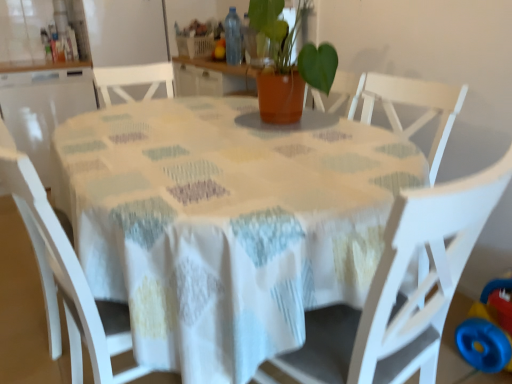
Question: Does terracotta pot at center appear on the right side of white fabric table at center?

Choices:
 (A) no
 (B) yes

Answer: (B)

Question: Is terracotta pot at center to the left of white fabric table at center from the viewer's perspective?

Choices:
 (A) no
 (B) yes

Answer: (A)

Question: From the image's perspective, is terracotta pot at center located beneath white fabric table at center?

Choices:
 (A) no
 (B) yes

Answer: (A)

Question: Is terracotta pot at center oriented towards white fabric table at center?

Choices:
 (A) yes
 (B) no

Answer: (B)

Question: From the image's perspective, is terracotta pot at center over white fabric table at center?

Choices:
 (A) yes
 (B) no

Answer: (A)

Question: Is terracotta pot at center far from white fabric table at center?

Choices:
 (A) yes
 (B) no

Answer: (B)

Question: Would you say blue plastic toy at lower right is part of white wood chair at center, which is the 2th chair from left to right,'s contents?

Choices:
 (A) yes
 (B) no

Answer: (B)

Question: Is white wood chair at center, the first chair when ordered from right to left, further to the viewer compared to blue plastic toy at lower right?

Choices:
 (A) yes
 (B) no

Answer: (B)

Question: From a real-world perspective, is white wood chair at center, which is the 2th chair from left to right, located beneath blue plastic toy at lower right?

Choices:
 (A) yes
 (B) no

Answer: (B)

Question: Would you consider white wood chair at center, which is the 2th chair from left to right, to be distant from blue plastic toy at lower right?

Choices:
 (A) yes
 (B) no

Answer: (B)

Question: Does white wood chair at center, which is the 2th chair from left to right, have a lesser width compared to blue plastic toy at lower right?

Choices:
 (A) no
 (B) yes

Answer: (A)

Question: From a real-world perspective, is white wood chair at center, which is the 2th chair from left to right, over blue plastic toy at lower right?

Choices:
 (A) yes
 (B) no

Answer: (A)

Question: From the image's perspective, is white fabric table at center below blue plastic toy at lower right?

Choices:
 (A) no
 (B) yes

Answer: (A)